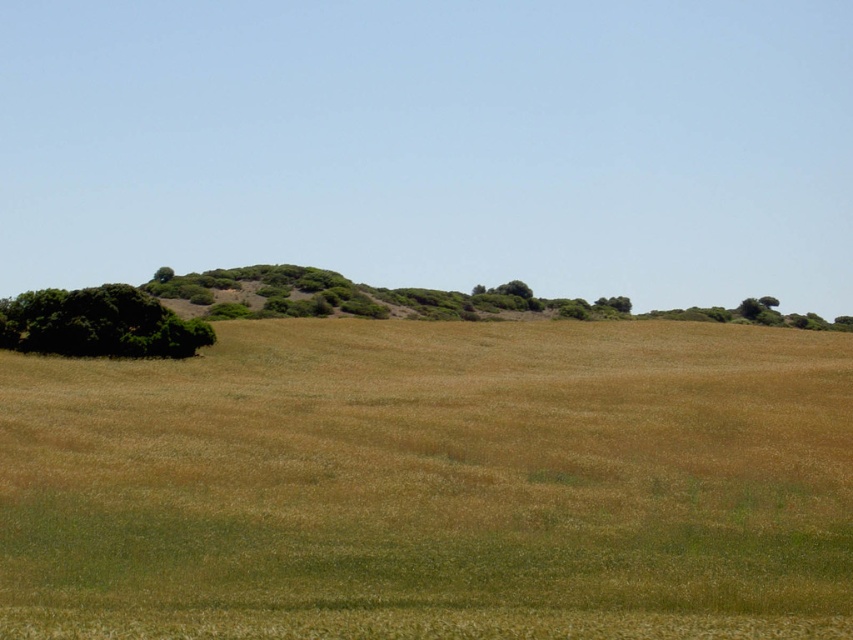
Between green leafy tree at left and green leafy tree at upper left, which one has less height?

With less height is green leafy tree at upper left.

Can you confirm if green leafy tree at left is positioned below green leafy tree at upper left?

Yes.

Identify the location of green leafy tree at left. (97, 323).

Where is `brown grassy field at center`? brown grassy field at center is located at coordinates (433, 483).

Can you confirm if brown grassy field at center is positioned to the right of green leafy tree at upper left?

Yes, brown grassy field at center is to the right of green leafy tree at upper left.

Is point (625, 515) more distant than point (163, 273)?

No, (625, 515) is in front of (163, 273).

Image resolution: width=853 pixels, height=640 pixels. Find the location of `brown grassy field at center`. brown grassy field at center is located at coordinates (433, 483).

Can you confirm if brown grassy field at center is positioned above green leafy tree at left?

Incorrect, brown grassy field at center is not positioned above green leafy tree at left.

Does brown grassy field at center appear under green leafy tree at left?

Yes, brown grassy field at center is below green leafy tree at left.

I want to click on brown grassy field at center, so click(x=433, y=483).